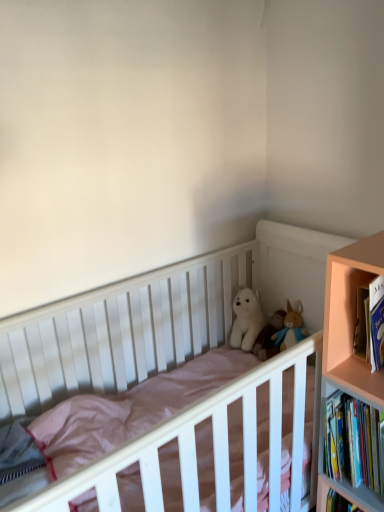
Question: From the image's perspective, is white plush bear at center, which is the first doll from right to left, positioned above or below pink wood bookcase at right?

Choices:
 (A) below
 (B) above

Answer: (B)

Question: Relative to pink wood bookcase at right, is white plush bear at center, placed as the 2th doll when sorted from left to right, in front or behind?

Choices:
 (A) behind
 (B) front

Answer: (A)

Question: Estimate the real-world distances between objects in this image. Which object is farther from the white plush bear at center, the second doll from the right?

Choices:
 (A) white plush toy at center
 (B) pink wood bookcase at right
 (C) hardcover books at right
 (D) white plush bear at center, which is the first doll from right to left
 (E) white wooden crib at center

Answer: (B)

Question: Which object is positioned closest to the white plush bear at center, placed as the 2th doll when sorted from left to right?

Choices:
 (A) white plush bear at center, the 1th doll positioned from the left
 (B) hardcover books at right
 (C) white wooden crib at center
 (D) pink wood bookcase at right
 (E) white plush toy at center

Answer: (E)